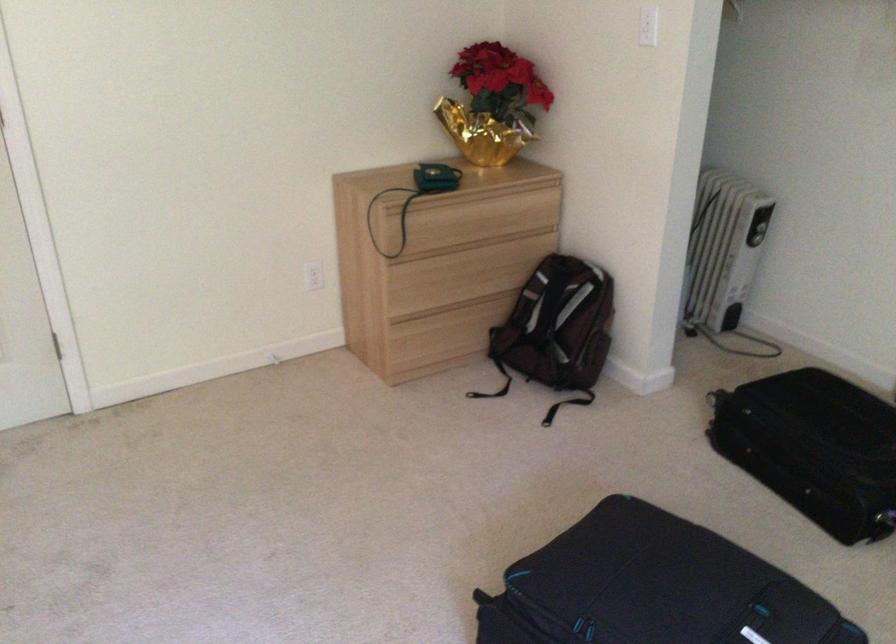
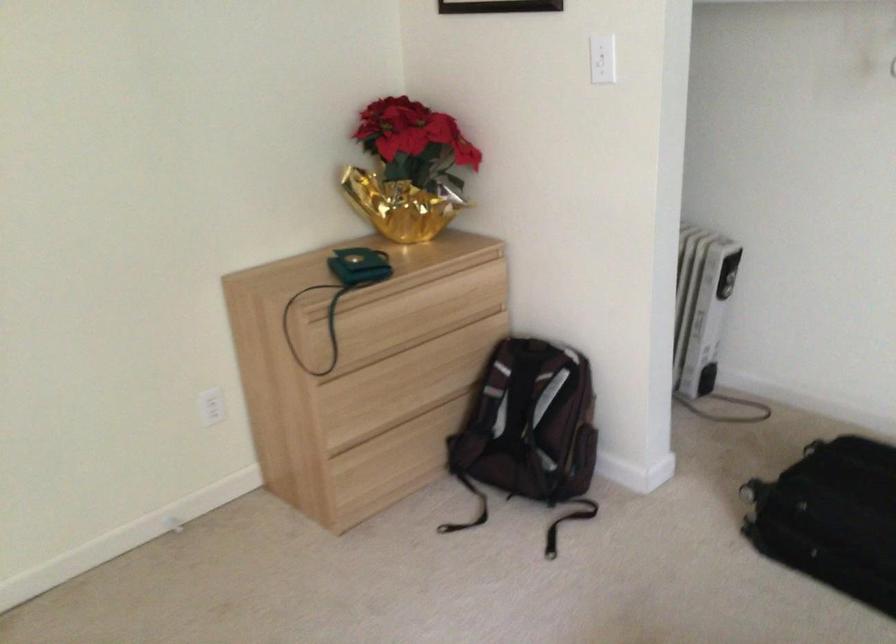
Question: The first image is from the beginning of the video and the second image is from the end. How did the camera likely rotate when shooting the video?

Choices:
 (A) Left
 (B) Right
 (C) Up
 (D) Down

Answer: (B)